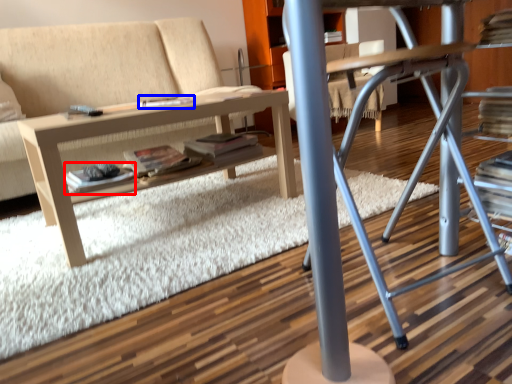
Question: Which of the following is the closest to the observer, paperback book (highlighted by a red box) or magazine (highlighted by a blue box)?

Choices:
 (A) paperback book
 (B) magazine

Answer: (A)